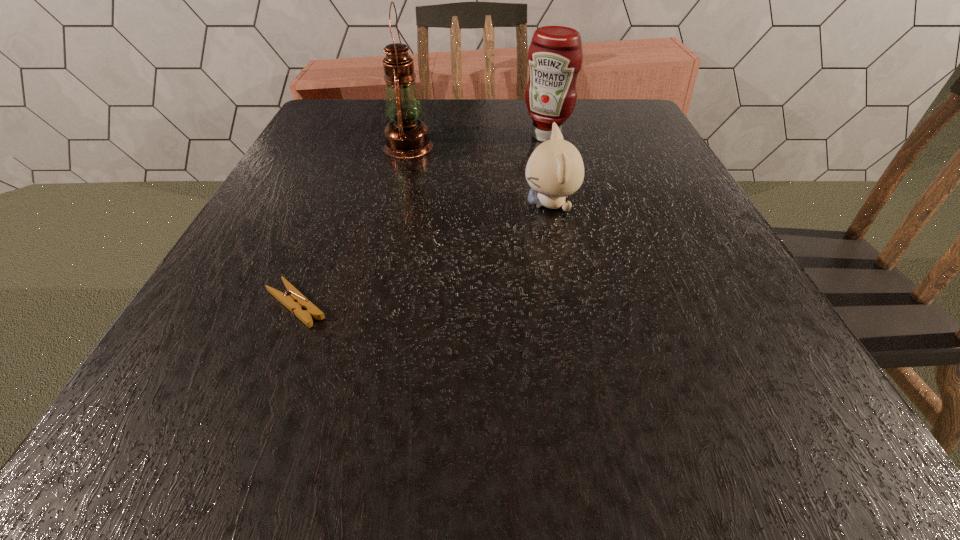
At what (x,y) coordinates should I click in order to perform the action: click on vacant region that satisfies the following two spatial constraints: 1. on the front side of the second tallest object; 2. on the face of the second shortest object. Please return your answer as a coordinate pair (x, y). This screenshot has height=540, width=960. Looking at the image, I should click on (562, 204).

In order to click on vacant space that satisfies the following two spatial constraints: 1. on the back side of the leftmost object; 2. on the right side of the second object from left to right in this screenshot , I will do `click(360, 146)`.